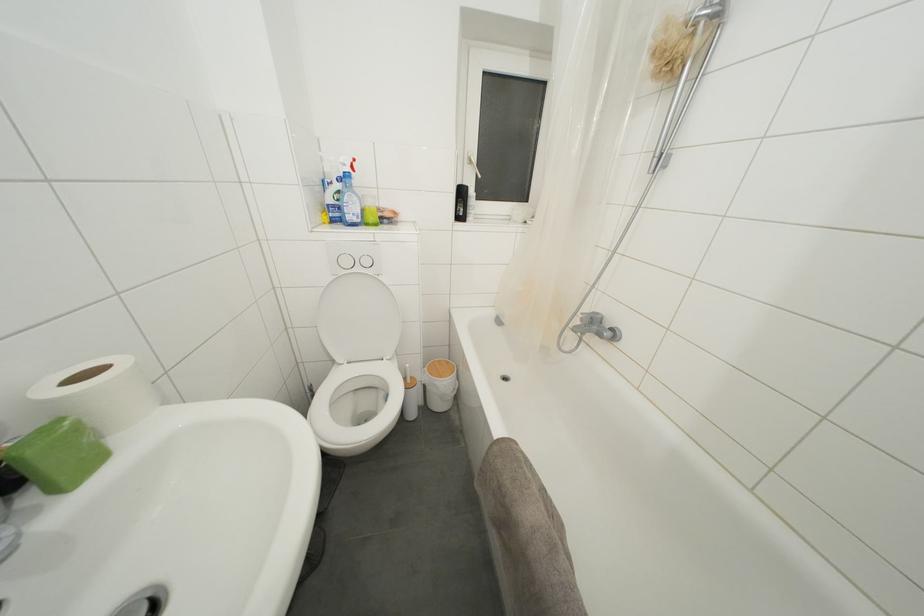
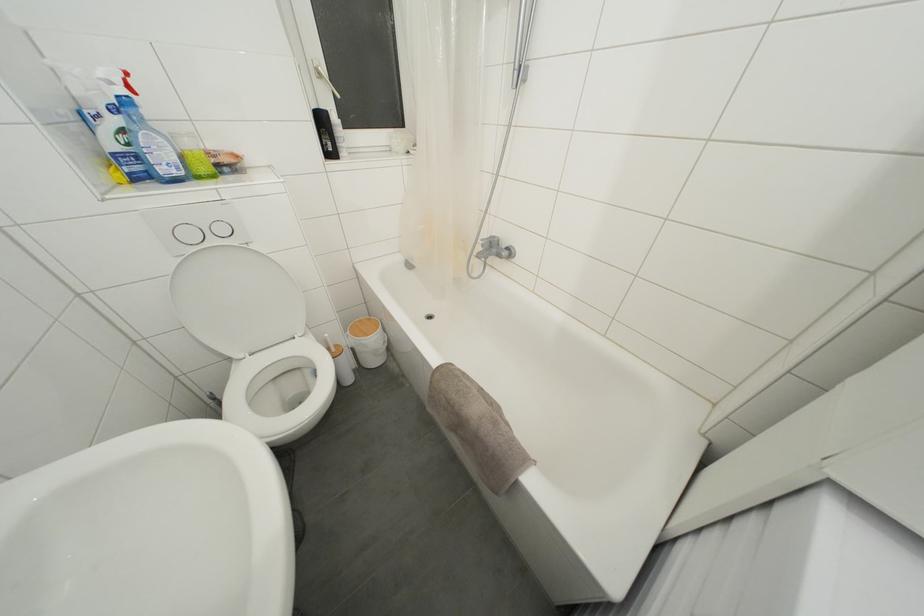
Where in the second image is the point corresponding to (x=350, y=267) from the first image?

(195, 240)